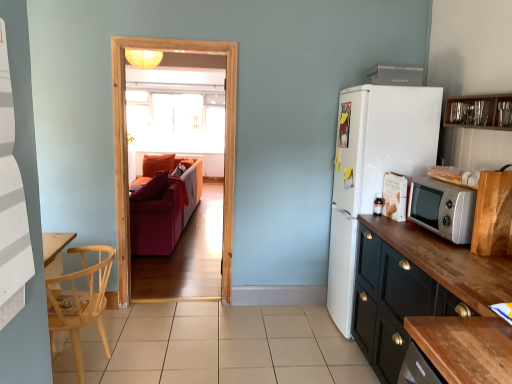
What are the coordinates of `vacant area that is in front of wooden cabinet at right, arranged as the second cabinetry when ordered from the bottom` in the screenshot? It's located at (496, 261).